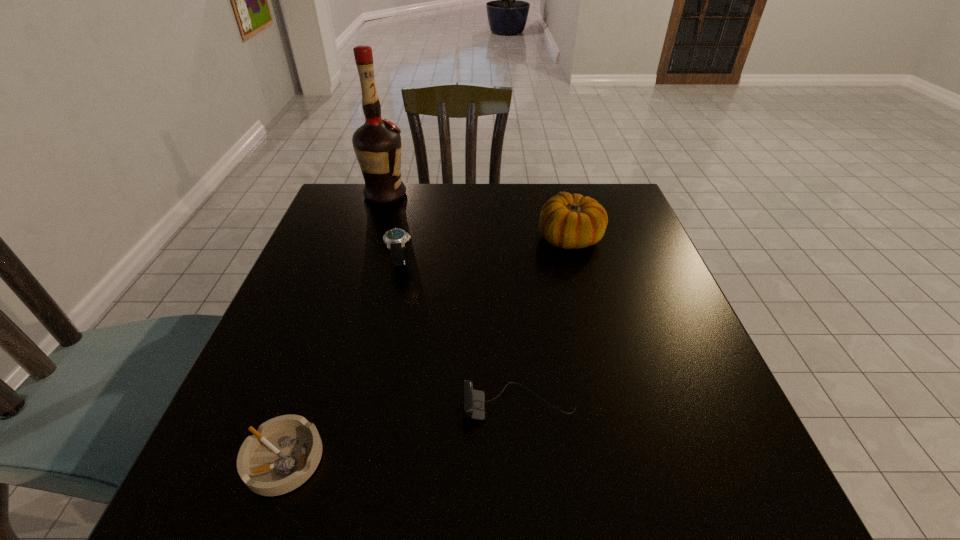
What are the coordinates of `vacant space in between the shortest object and the second shortest object` in the screenshot? It's located at [x=401, y=431].

Locate an element on the screen. The width and height of the screenshot is (960, 540). free space between the ashtray and the second shortest object is located at coordinates (401, 431).

The width and height of the screenshot is (960, 540). In order to click on free space that is in between the third tallest object and the tallest object in this screenshot , I will do `click(393, 228)`.

Image resolution: width=960 pixels, height=540 pixels. I want to click on vacant space that's between the third shortest object and the webcam, so click(x=460, y=333).

The image size is (960, 540). Find the location of `free space between the liquor and the shortest object`. free space between the liquor and the shortest object is located at coordinates (335, 327).

Locate an element on the screen. The image size is (960, 540). free space between the third shortest object and the tallest object is located at coordinates (393, 228).

Identify which object is located as the third nearest to the gourd. Please provide its 2D coordinates. Your answer should be formatted as a tuple, i.e. [(x, y)], where the tuple contains the x and y coordinates of a point satisfying the conditions above.

[(377, 143)]

Identify which object is the second closest to the third shortest object. Please provide its 2D coordinates. Your answer should be formatted as a tuple, i.e. [(x, y)], where the tuple contains the x and y coordinates of a point satisfying the conditions above.

[(568, 221)]

The height and width of the screenshot is (540, 960). I want to click on free space in the image that satisfies the following two spatial constraints: 1. on the front and back of the gourd; 2. on the left side of the farthest object, so click(x=372, y=238).

Where is `free point that satisfies the following two spatial constraints: 1. on the front and back of the second tallest object; 2. on the right side of the tallest object`? free point that satisfies the following two spatial constraints: 1. on the front and back of the second tallest object; 2. on the right side of the tallest object is located at coordinates (372, 238).